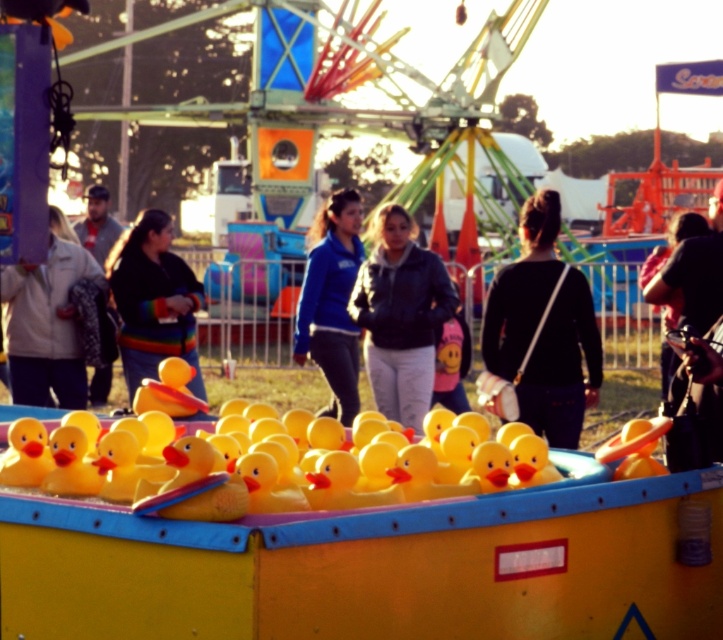
Who is taller, rainbow striped sweater at center or dark blue jacket at center?

dark blue jacket at center

Image resolution: width=723 pixels, height=640 pixels. In order to click on rainbow striped sweater at center in this screenshot , I will do `click(153, 300)`.

Which of these two, black matte jacket at center or blue fleece jacket at center, stands taller?

blue fleece jacket at center

At what (x,y) coordinates should I click in order to perform the action: click on black matte jacket at center. Please return your answer as a coordinate pair (x, y). This screenshot has height=640, width=723. Looking at the image, I should click on 562,365.

Which is above, light beige jacket at left or rainbow striped sweater at center?

light beige jacket at left is above.

Between light beige jacket at left and rainbow striped sweater at center, which one is positioned lower?

rainbow striped sweater at center is below.

At what (x,y) coordinates should I click in order to perform the action: click on light beige jacket at left. Please return your answer as a coordinate pair (x, y). Looking at the image, I should click on (46, 323).